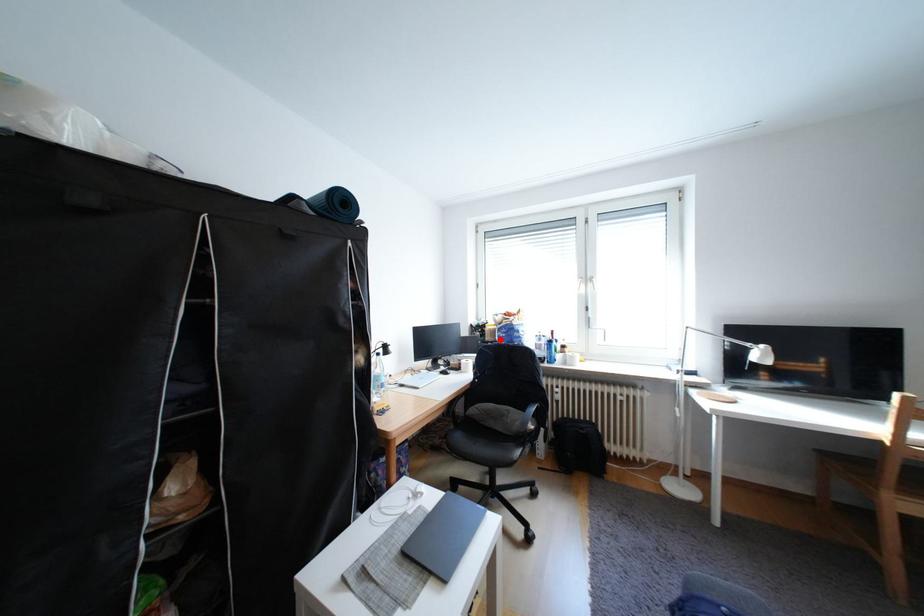
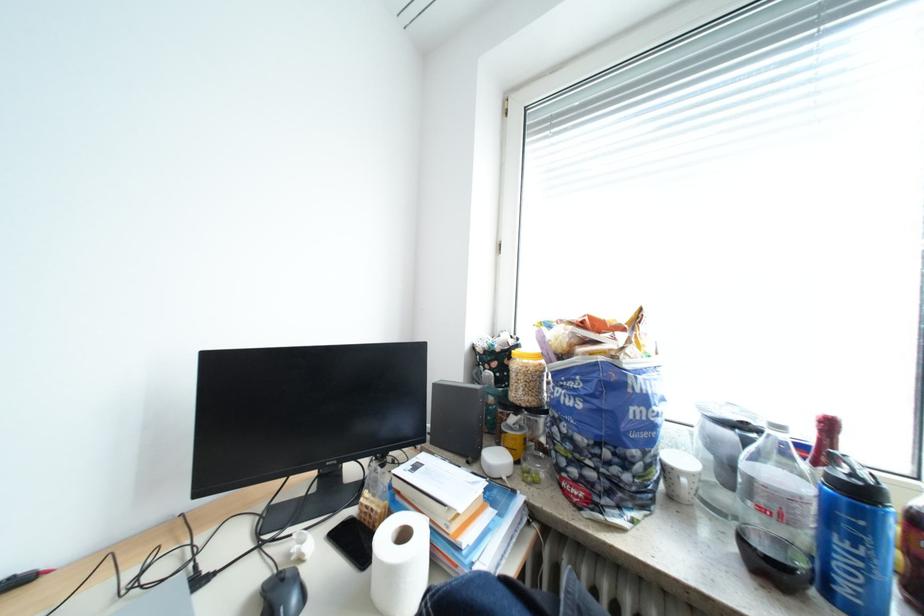
Find the pixel in the second image that matches the highlighted location in the first image.

(529, 394)